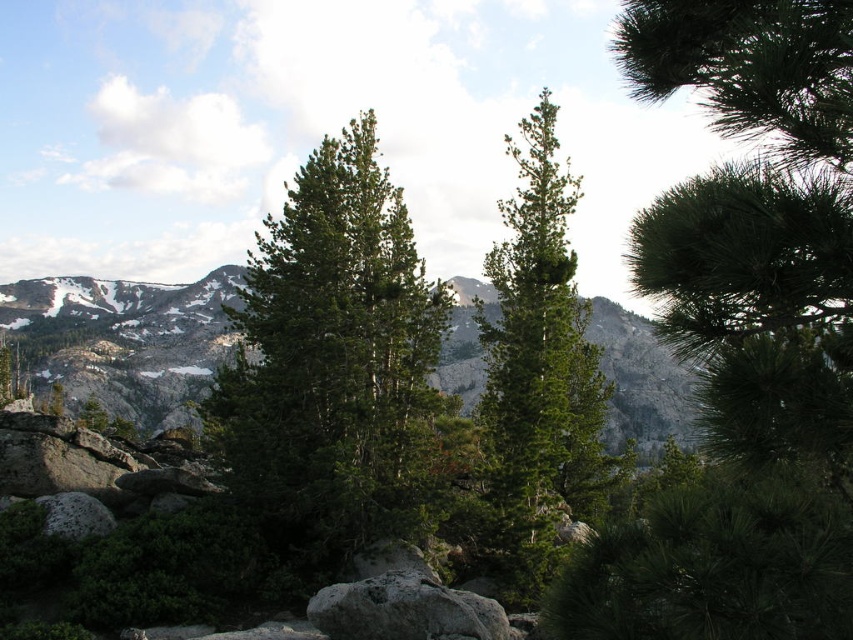
Question: Does green needle-like tree at center have a larger size compared to green matte tree at center?

Choices:
 (A) yes
 (B) no

Answer: (B)

Question: Which of the following is the closest to the observer?

Choices:
 (A) green needle-like tree at center
 (B) green matte tree at center
 (C) green needle-like at center

Answer: (C)

Question: Among these points, which one is farthest from the camera?

Choices:
 (A) (614, 616)
 (B) (285, 316)
 (C) (572, 388)
 (D) (210, 314)

Answer: (D)

Question: From the image, what is the correct spatial relationship of green needle-like tree at center in relation to green matte tree at center?

Choices:
 (A) left
 (B) right

Answer: (A)

Question: Can you confirm if green needle-like at center is positioned below green matte tree at center?

Choices:
 (A) no
 (B) yes

Answer: (A)

Question: Which object is farther from the camera taking this photo?

Choices:
 (A) rocky gray mountain at center
 (B) green matte tree at center

Answer: (A)